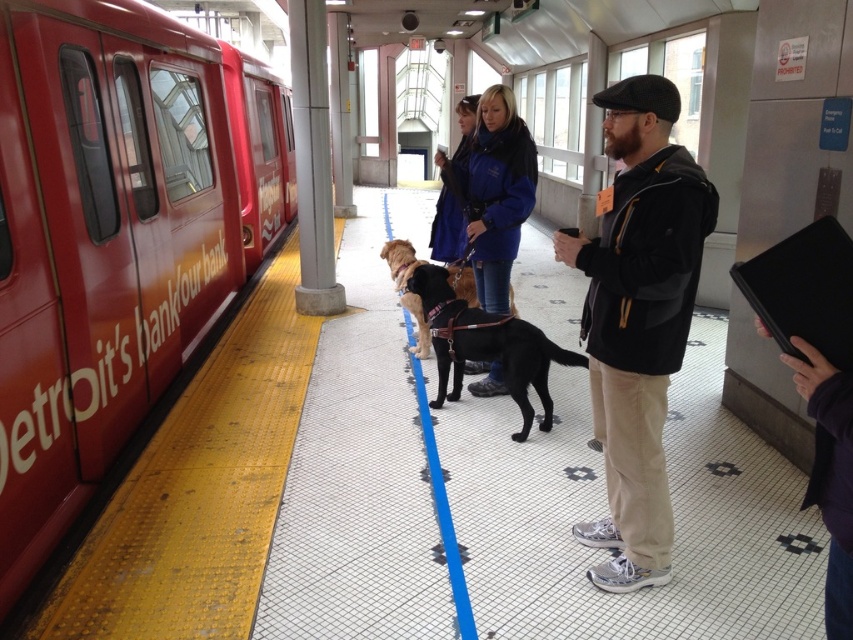
Does red matte train at left appear on the right side of purple fabric at right?

In fact, red matte train at left is to the left of purple fabric at right.

Is red matte train at left above purple fabric at right?

Indeed, red matte train at left is positioned over purple fabric at right.

At what (x,y) coordinates should I click in order to perform the action: click on red matte train at left. Please return your answer as a coordinate pair (x, y). The height and width of the screenshot is (640, 853). Looking at the image, I should click on (115, 236).

This screenshot has height=640, width=853. In order to click on red matte train at left in this screenshot , I will do `click(115, 236)`.

Can you confirm if red matte train at left is shorter than black leather dog at center?

Incorrect, red matte train at left's height does not fall short of black leather dog at center's.

Does point (56, 42) lie behind point (541, 378)?

No.

Locate an element on the screen. red matte train at left is located at coordinates coord(115,236).

The image size is (853, 640). What are the coordinates of `red matte train at left` in the screenshot? It's located at (115, 236).

Between black matte jacket at center and black leather dog at center, which one has less height?

With less height is black leather dog at center.

Does black matte jacket at center have a lesser width compared to black leather dog at center?

Correct, black matte jacket at center's width is less than black leather dog at center's.

Between point (670, 538) and point (502, 337), which one is positioned behind?

The point (502, 337) is behind.

Locate an element on the screen. This screenshot has height=640, width=853. black matte jacket at center is located at coordinates (637, 320).